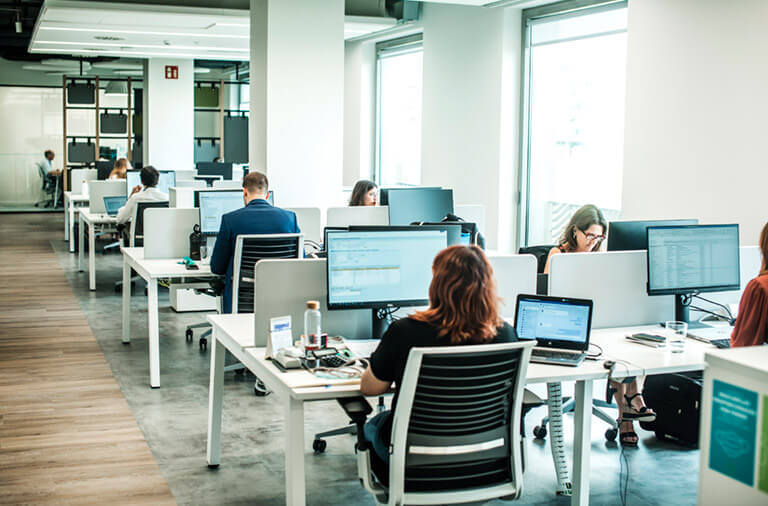
Locate an element on the screen. Image resolution: width=768 pixels, height=506 pixels. computer chairs is located at coordinates (44, 182), (270, 247), (137, 221), (444, 389), (538, 252).